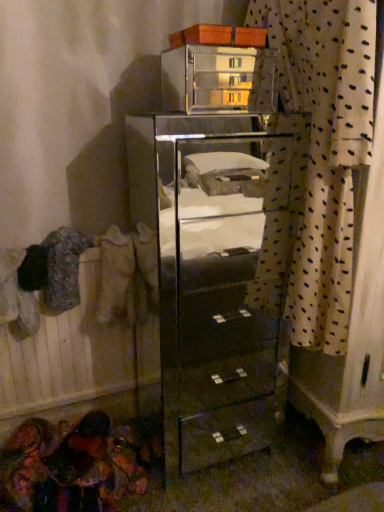
Locate an element on the screen. vacant space in front of clear glass cabinet at center is located at coordinates (235, 490).